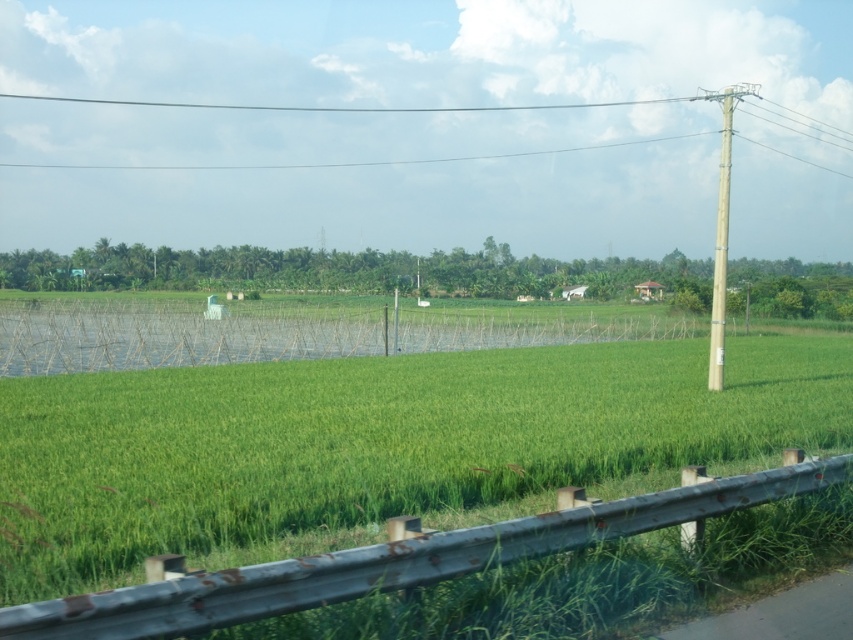
Which is in front, point (527, 593) or point (206, 108)?

Point (527, 593) is more forward.

Can you confirm if green grass at center is positioned below smooth wire power line at upper center?

Yes, green grass at center is below smooth wire power line at upper center.

This screenshot has width=853, height=640. In order to click on green grass at center in this screenshot , I will do `click(381, 444)`.

The image size is (853, 640). What are the coordinates of `green grass at center` in the screenshot? It's located at (381, 444).